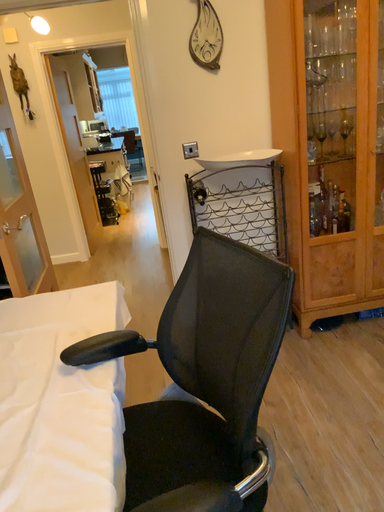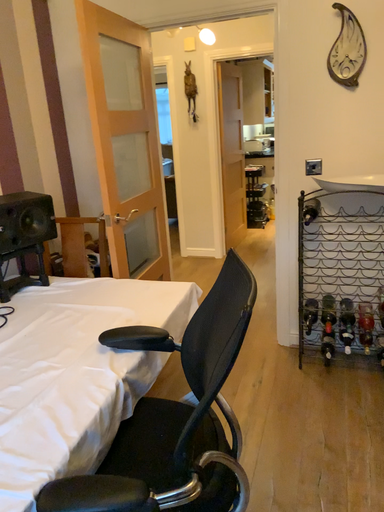
Question: Which way did the camera rotate in the video?

Choices:
 (A) rotated right
 (B) rotated left

Answer: (B)